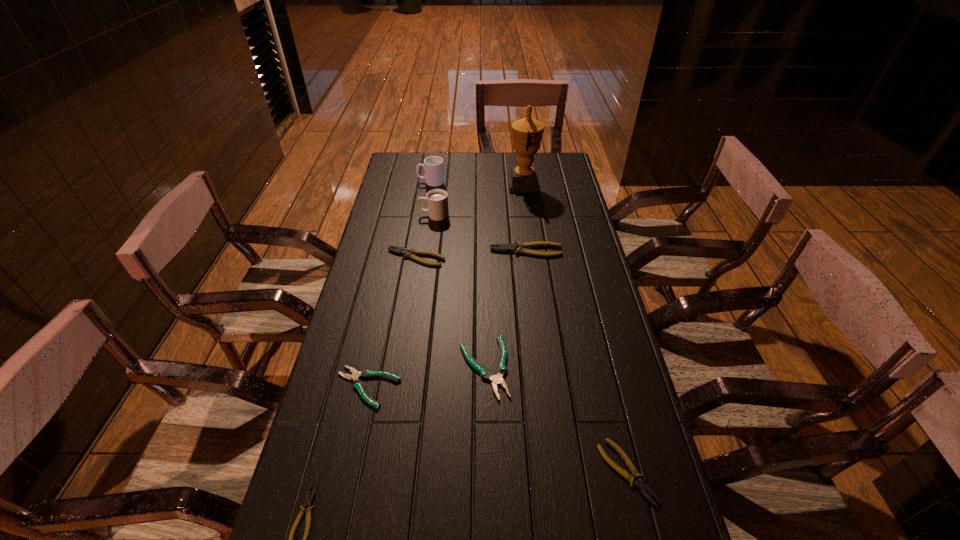
Identify the location of blank space at the left edge of the desktop. (372, 377).

Find the location of `vacant space at the right edge of the desktop`. vacant space at the right edge of the desktop is located at coordinates (569, 195).

Find the location of `vacant region between the right teal pliers and the third biggest yellow pliers`. vacant region between the right teal pliers and the third biggest yellow pliers is located at coordinates (555, 419).

Identify the location of vacant space that's between the second smallest yellow pliers and the smaller teal pliers. This screenshot has height=540, width=960. coord(497,429).

Where is `empty space that is in between the second smallest yellow pliers and the award`? This screenshot has height=540, width=960. empty space that is in between the second smallest yellow pliers and the award is located at coordinates (575, 328).

This screenshot has width=960, height=540. I want to click on free space that is in between the cup and the tallest object, so click(477, 183).

Find the location of `vacant space in between the seventh nearest object and the tallest pliers`. vacant space in between the seventh nearest object and the tallest pliers is located at coordinates (480, 233).

Locate an element on the screen. This screenshot has height=540, width=960. free point between the seventh nearest object and the golden award is located at coordinates (479, 200).

Locate an element on the screen. vacant space that is in between the third smallest yellow pliers and the tallest pliers is located at coordinates (471, 254).

Where is `object that is the third closest one to the cup`? The height and width of the screenshot is (540, 960). object that is the third closest one to the cup is located at coordinates (410, 252).